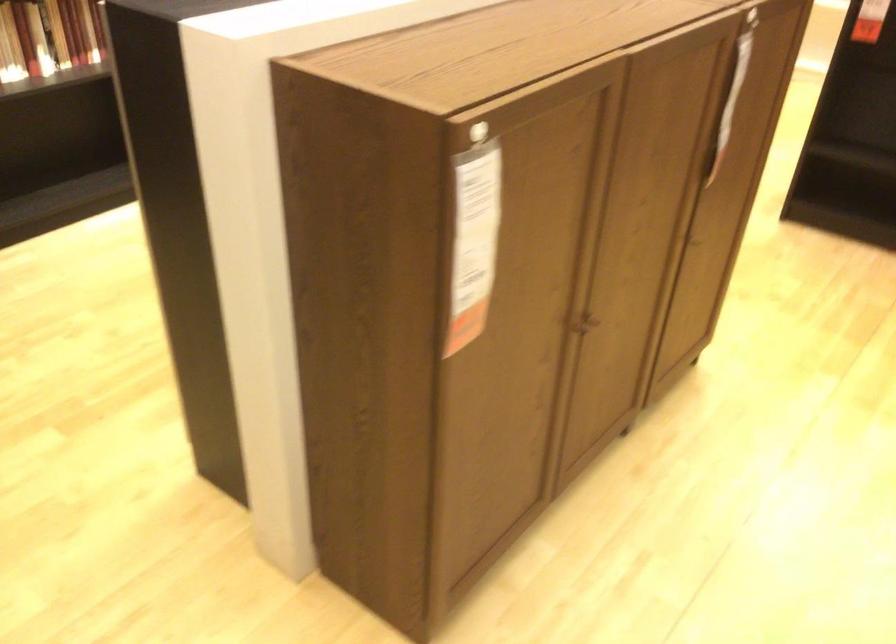
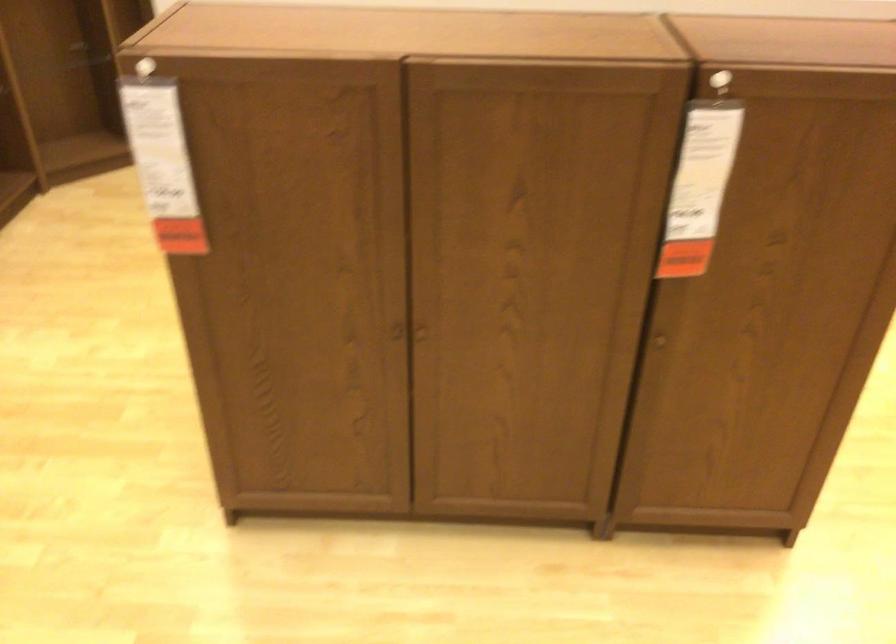
Locate, in the second image, the point that corresponds to point 739,80 in the first image.

(702, 169)